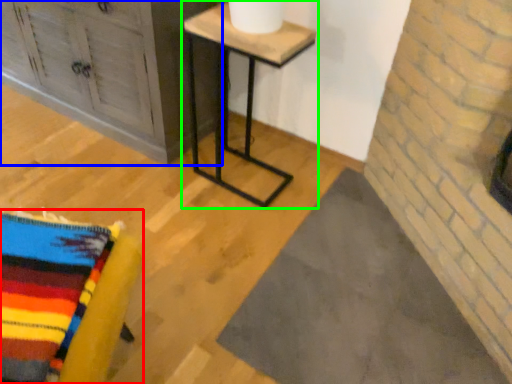
Question: Which is farther away from furniture (highlighted by a red box)? furniture (highlighted by a blue box) or table (highlighted by a green box)?

Choices:
 (A) furniture
 (B) table

Answer: (A)